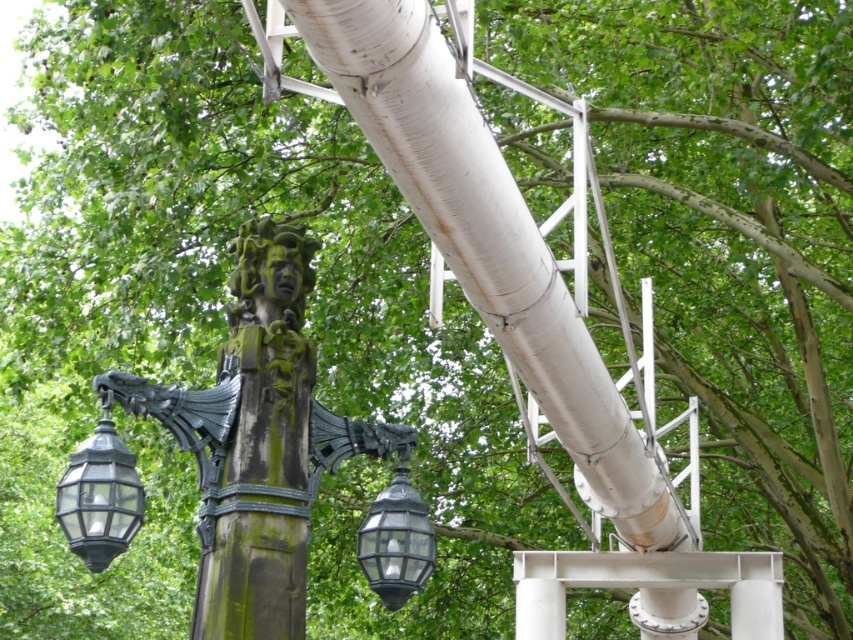
You are standing in front of the lamppost and want to locate the point at coordinates (99, 497). Which object is this point located on?

The point at coordinates (99, 497) is located on the matte black lantern at lower left.